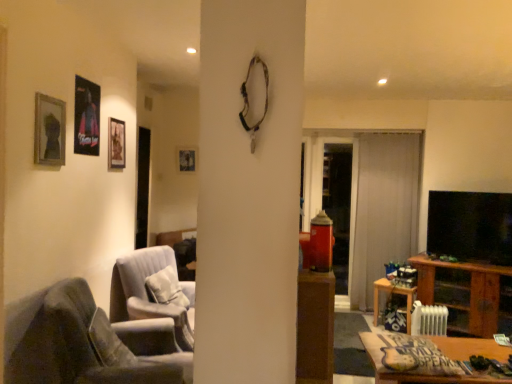
Question: From a real-world perspective, is matte black picture frame at upper center, which appears as the 4th picture frame when viewed from the left, physically located above or below wooden cabinet at right?

Choices:
 (A) below
 (B) above

Answer: (B)

Question: In terms of size, does matte black picture frame at upper center, the fourth picture frame from the front, appear bigger or smaller than wooden cabinet at right?

Choices:
 (A) big
 (B) small

Answer: (B)

Question: Estimate the real-world distances between objects in this image. Which object is closer to the matte black picture frame at upper left, which is counted as the 2th picture frame, starting from the right?

Choices:
 (A) wooden table at lower right, acting as the 1th table starting from the front
 (B) velvet grey armchair at lower left, the first chair positioned from the front
 (C) suede-like gray pillow at lower left
 (D) velvet white armchair at center, placed as the second chair when sorted from front to back
 (E) white sheer curtain at center

Answer: (D)

Question: Estimate the real-world distances between objects in this image. Which object is closer to the suede-like gray pillow at lower left?

Choices:
 (A) matte black picture frame at upper center, which appears as the 4th picture frame when viewed from the left
 (B) matte black picture frame at upper left, the third picture frame from the left
 (C) wooden table at lower right, which is the 2th table from top to bottom
 (D) transparent glass door at center
 (E) velvet grey armchair at lower left, the first chair positioned from the front

Answer: (E)